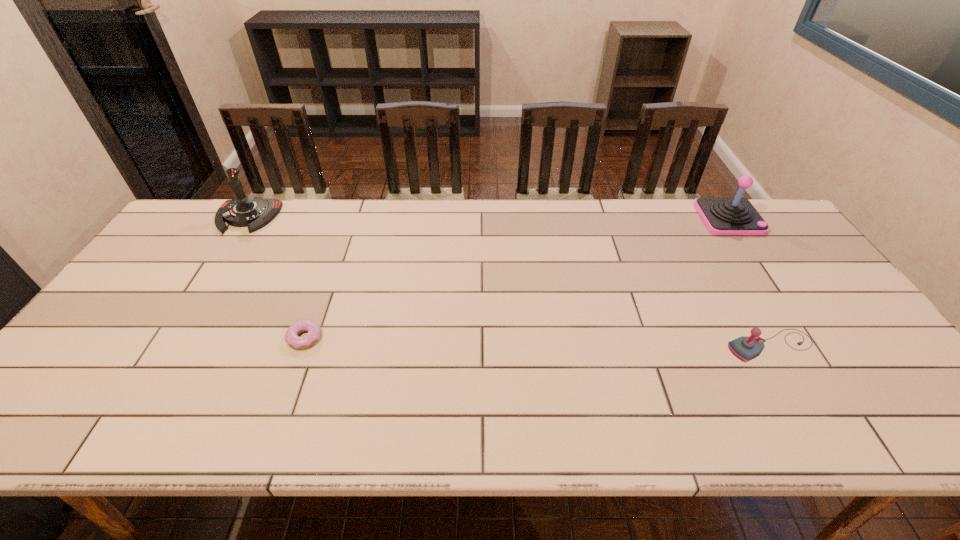
What are the coordinates of `object at the far right corner` in the screenshot? It's located at (x=736, y=215).

I want to click on free point at the far edge, so click(455, 206).

At what (x,y) coordinates should I click in order to perform the action: click on vacant space at the near edge of the desktop. Please return your answer as a coordinate pair (x, y). Looking at the image, I should click on (247, 415).

Identify the location of blank space at the left edge of the desktop. (179, 300).

You are a GUI agent. You are given a task and a screenshot of the screen. Output one action in this format:
    pyautogui.click(x=<x>, y=<y>)
    Task: Click on the vacant area at the right edge
    
    Given the screenshot: What is the action you would take?
    pyautogui.click(x=894, y=388)

Where is `free space at the near left corner of the desktop`? This screenshot has height=540, width=960. free space at the near left corner of the desktop is located at coordinates (62, 409).

Where is `vacant space at the near right corner of the desktop`? vacant space at the near right corner of the desktop is located at coordinates (900, 418).

The width and height of the screenshot is (960, 540). I want to click on free spot between the nearest joystick and the shortest object, so click(x=538, y=342).

Where is `vacant space in between the leftmost object and the shortest joystick`? vacant space in between the leftmost object and the shortest joystick is located at coordinates (509, 281).

Locate an element on the screen. This screenshot has height=540, width=960. vacant area that lies between the nearest joystick and the leftmost joystick is located at coordinates (509, 281).